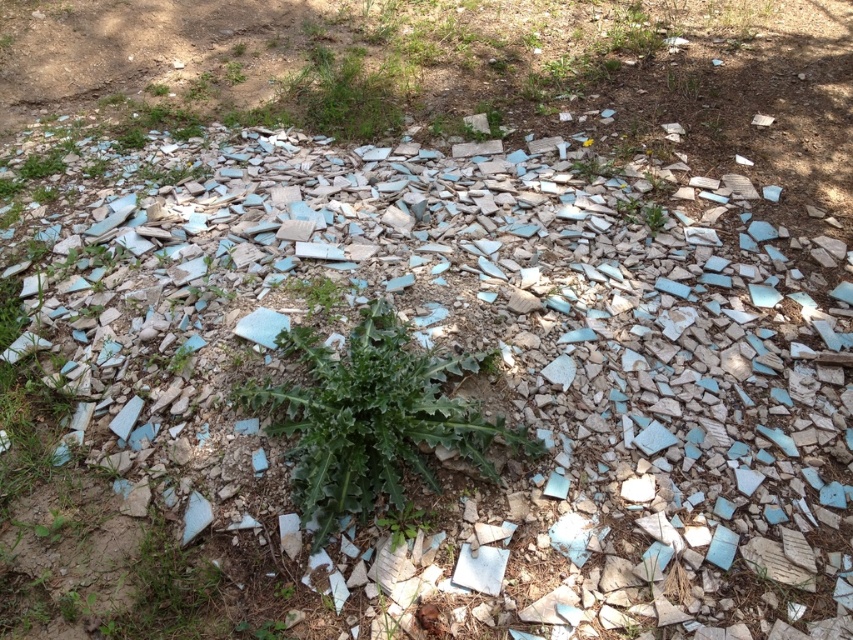
You are standing in the abandoned area with scattered tiles and want to reach the green leafy plant at lower left. Which direction should you move from the green leafy plant at center to get there?

To reach the green leafy plant at lower left from the green leafy plant at center, you should move towards the lower left direction since the plant at lower left is closer to you than the one at center, which is further away.

You are a gardener trying to locate the green leafy plant at upper center. From the green leafy plant at lower left, in which direction should you move to find it?

The green leafy plant at lower left is below the green leafy plant at upper center, so you should move upward to find the plant at upper center.

From the picture: You are a gardener who wants to transplant both the green leafy plant at lower left and the green leafy plant at upper center to a new garden bed. Based on their sizes, which one should you prioritize moving first to ensure it has enough space?

The green leafy plant at lower left is much taller than the green leafy plant at upper center, so you should prioritize moving the green leafy plant at lower left first to ensure it has sufficient space in the new garden bed.